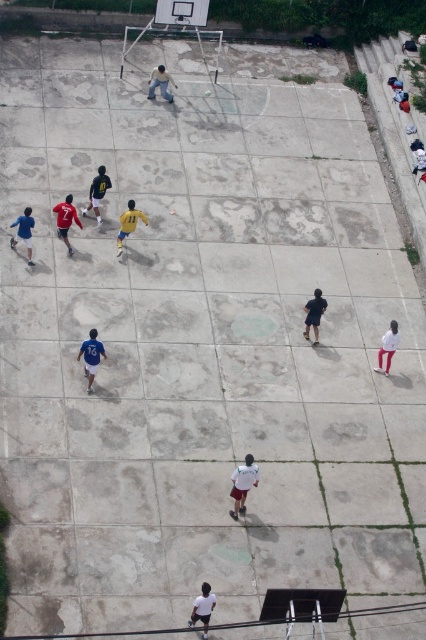
Is point (92, 348) less distant than point (26, 212)?

Yes.

The height and width of the screenshot is (640, 426). In order to click on blue matte jersey at lower left in this screenshot , I will do `click(91, 356)`.

At what (x,y) coordinates should I click in order to perform the action: click on blue matte jersey at lower left. Please return your answer as a coordinate pair (x, y). The width and height of the screenshot is (426, 640). Looking at the image, I should click on (91, 356).

Does point (253, 483) come in front of point (17, 228)?

That is True.

Measure the distance from white matte shirt at center to blue fabric shirt at left.

white matte shirt at center and blue fabric shirt at left are 8.80 meters apart from each other.

Where is `white matte shirt at center`? This screenshot has height=640, width=426. white matte shirt at center is located at coordinates pyautogui.click(x=242, y=484).

Is white matte shirt at center smaller than matte red jersey at left?

Indeed, white matte shirt at center has a smaller size compared to matte red jersey at left.

Which is behind, point (241, 488) or point (65, 220)?

The point (65, 220) is behind.

Where is `white matte shirt at center`? white matte shirt at center is located at coordinates (242, 484).